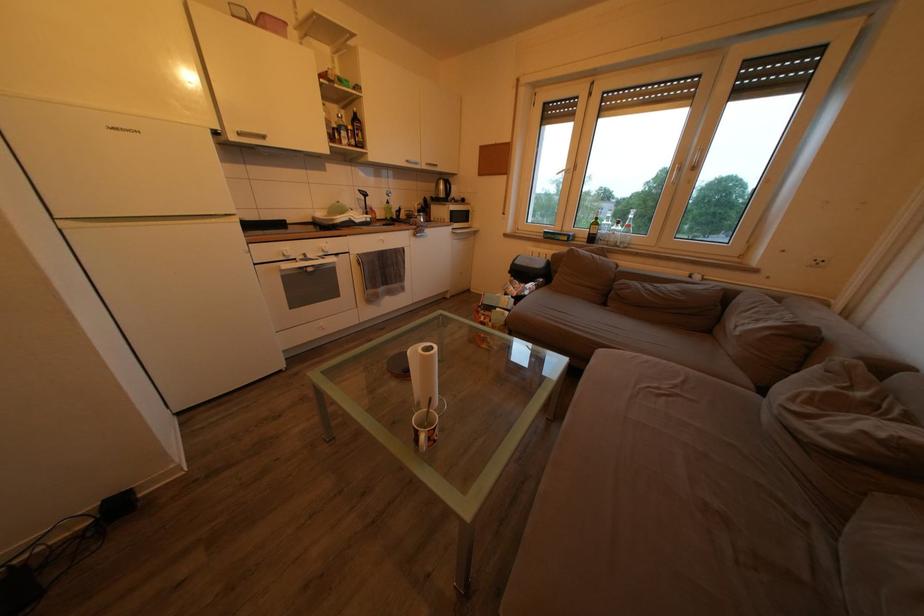
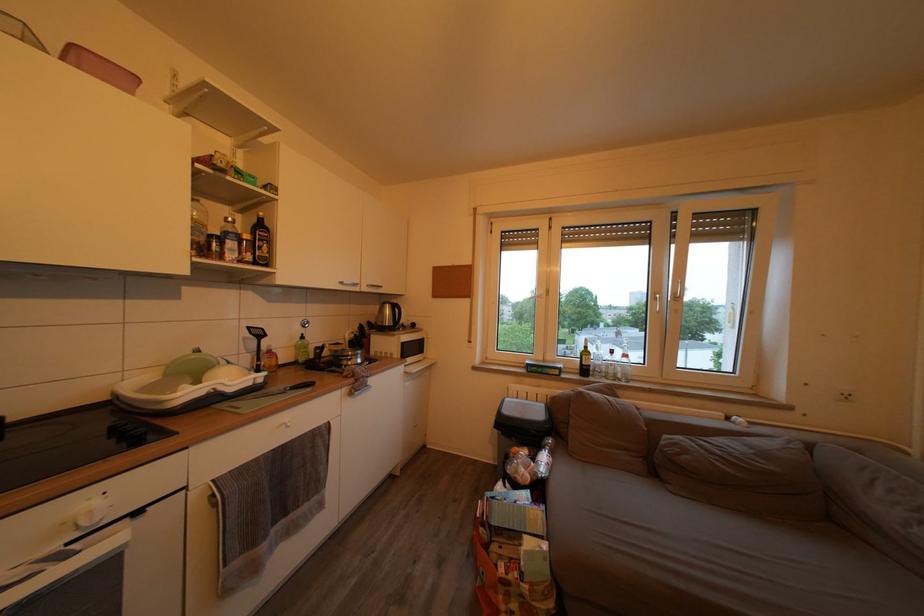
Find the pixel in the second image that matches point (419, 238) in the first image.

(351, 395)